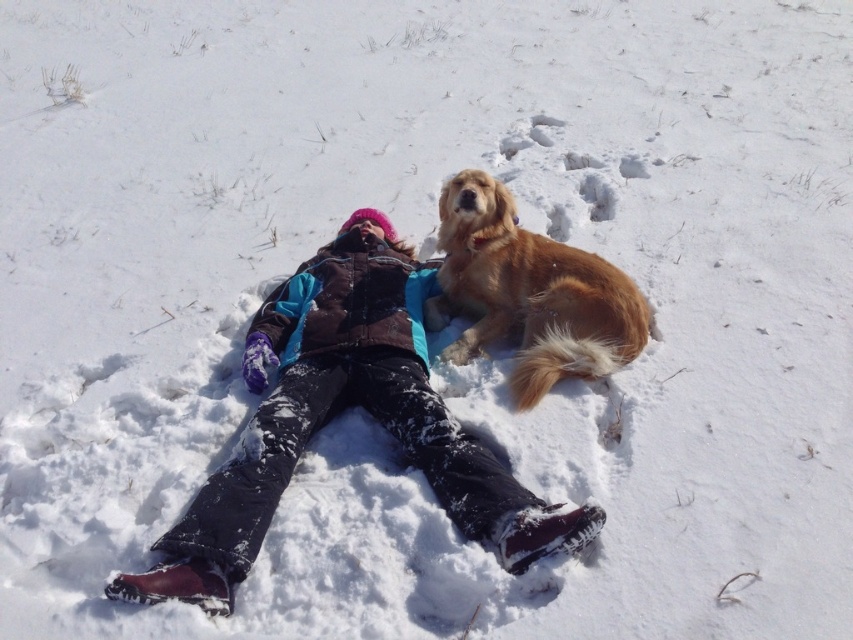
Does velvet brown jacket at center appear over golden fur dog at upper right?

No, velvet brown jacket at center is not above golden fur dog at upper right.

From the picture: Is velvet brown jacket at center to the right of golden fur dog at upper right from the viewer's perspective?

Incorrect, velvet brown jacket at center is not on the right side of golden fur dog at upper right.

The image size is (853, 640). I want to click on velvet brown jacket at center, so click(x=338, y=412).